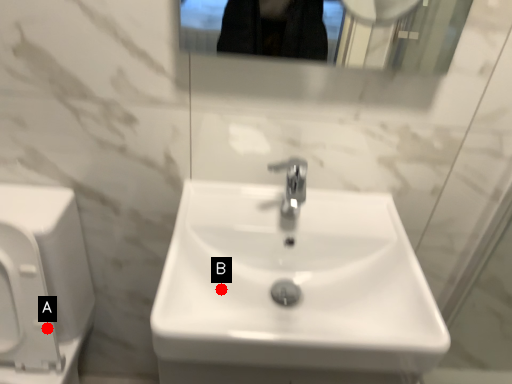
Question: Two points are circled on the image, labeled by A and B beside each circle. Which point is closer to the camera?

Choices:
 (A) A is closer
 (B) B is closer

Answer: (B)